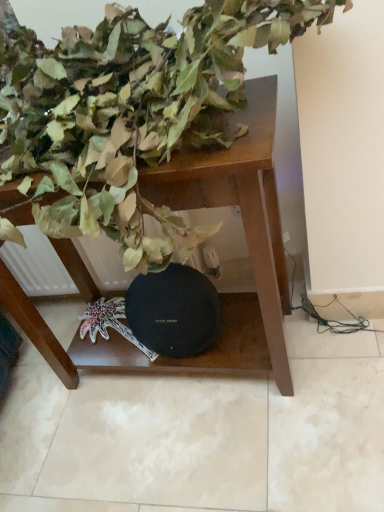
Describe the element at coordinates (129, 103) in the screenshot. I see `green matte leaves at upper left` at that location.

You are a GUI agent. You are given a task and a screenshot of the screen. Output one action in this format:
    pyautogui.click(x=<x>, y=<y>)
    Task: Click on the green matte leaves at upper left
    The image size is (384, 512).
    Given the screenshot: What is the action you would take?
    pyautogui.click(x=129, y=103)

What do you see at coordinates (222, 294) in the screenshot? This screenshot has height=512, width=384. I see `brown wooden table at center` at bounding box center [222, 294].

This screenshot has height=512, width=384. In order to click on brown wooden table at center in this screenshot , I will do `click(222, 294)`.

Image resolution: width=384 pixels, height=512 pixels. Find the location of `green matte leaves at upper left`. green matte leaves at upper left is located at coordinates (129, 103).

Between green matte leaves at upper left and brown wooden table at center, which one appears on the right side from the viewer's perspective?

From the viewer's perspective, brown wooden table at center appears more on the right side.

Considering their positions, is green matte leaves at upper left located in front of or behind brown wooden table at center?

Clearly, green matte leaves at upper left is in front of brown wooden table at center.

Is point (111, 40) more distant than point (237, 342)?

No.

From the image's perspective, relative to brown wooden table at center, is green matte leaves at upper left above or below?

From the image's perspective, green matte leaves at upper left appears above brown wooden table at center.

From a real-world perspective, is green matte leaves at upper left physically located above or below brown wooden table at center?

From a real-world perspective, green matte leaves at upper left is physically above brown wooden table at center.

Is green matte leaves at upper left wider or thinner than brown wooden table at center?

green matte leaves at upper left is wider than brown wooden table at center.

Can you confirm if green matte leaves at upper left is shorter than brown wooden table at center?

Correct, green matte leaves at upper left is not as tall as brown wooden table at center.

Considering the sizes of objects green matte leaves at upper left and brown wooden table at center in the image provided, who is bigger, green matte leaves at upper left or brown wooden table at center?

green matte leaves at upper left is bigger.

Would you say green matte leaves at upper left is inside or outside brown wooden table at center?

green matte leaves at upper left cannot be found inside brown wooden table at center.

Is there a large distance between green matte leaves at upper left and brown wooden table at center?

No, green matte leaves at upper left is not far from brown wooden table at center.

Consider the image. Is green matte leaves at upper left aimed at brown wooden table at center?

No.

Measure the distance from green matte leaves at upper left to brown wooden table at center.

green matte leaves at upper left and brown wooden table at center are 7.84 inches apart.

Where is `table behind the green matte leaves at upper left`? The height and width of the screenshot is (512, 384). table behind the green matte leaves at upper left is located at coordinates (222, 294).

Does brown wooden table at center appear on the right side of green matte leaves at upper left?

Indeed, brown wooden table at center is positioned on the right side of green matte leaves at upper left.

Which is behind, brown wooden table at center or green matte leaves at upper left?

brown wooden table at center is more distant.

Does point (250, 187) appear closer or farther from the camera than point (305, 18)?

Point (250, 187) is farther from the camera than point (305, 18).

From the image's perspective, which object appears higher, brown wooden table at center or green matte leaves at upper left?

green matte leaves at upper left appears higher in the image.

From a real-world perspective, is brown wooden table at center physically below green matte leaves at upper left?

Yes, from a real-world perspective, brown wooden table at center is below green matte leaves at upper left.

Is brown wooden table at center wider than green matte leaves at upper left?

Incorrect, the width of brown wooden table at center does not surpass that of green matte leaves at upper left.

Considering the relative sizes of brown wooden table at center and green matte leaves at upper left in the image provided, is brown wooden table at center shorter than green matte leaves at upper left?

In fact, brown wooden table at center may be taller than green matte leaves at upper left.

Who is smaller, brown wooden table at center or green matte leaves at upper left?

With smaller size is brown wooden table at center.

Can green matte leaves at upper left be found inside brown wooden table at center?

Actually, green matte leaves at upper left is outside brown wooden table at center.

Would you say brown wooden table at center is a long distance from green matte leaves at upper left?

brown wooden table at center is near green matte leaves at upper left, not far away.

Could you tell me if brown wooden table at center is turned towards green matte leaves at upper left?

No, brown wooden table at center is not oriented towards green matte leaves at upper left.

Where is `houseplant above the brown wooden table at center (from a real-world perspective)`? The height and width of the screenshot is (512, 384). houseplant above the brown wooden table at center (from a real-world perspective) is located at coordinates (129, 103).

Locate an element on the screen. The height and width of the screenshot is (512, 384). houseplant in front of the brown wooden table at center is located at coordinates (129, 103).

Where is `table located on the right of green matte leaves at upper left`? This screenshot has height=512, width=384. table located on the right of green matte leaves at upper left is located at coordinates (222, 294).